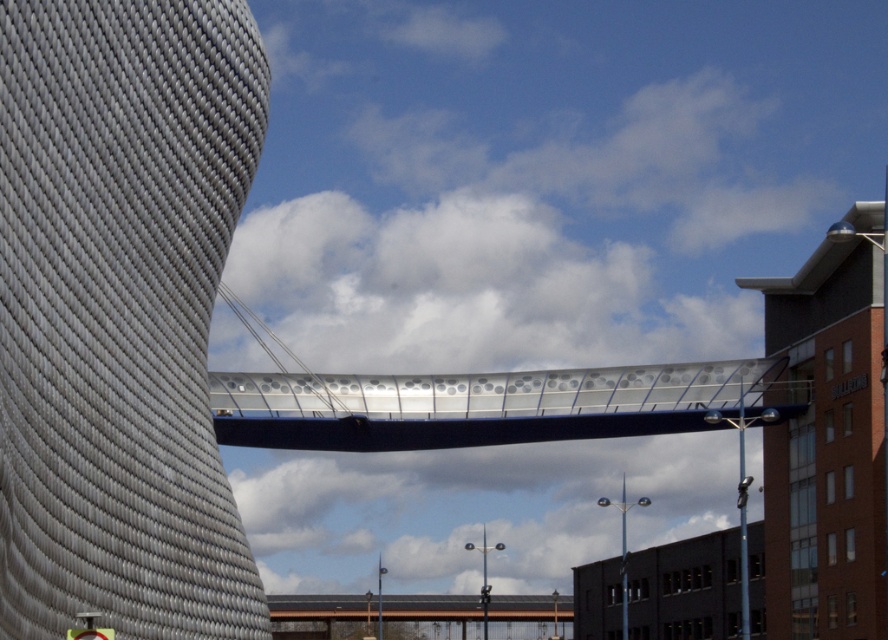
You are an architect evaluating the urban scene. The textured gray tower at center and the metallic gray pedestrian bridge at center are both central to the design. Which structure is taller?

The textured gray tower at center is taller than the metallic gray pedestrian bridge at center.

You are a tourist standing on the metallic silver pedestrian bridge at center and want to take a photo of the brick building at right. Which direction should you face to capture it in your shot?

You should face to the right side of the metallic silver pedestrian bridge at center to capture the brick building at right in your shot, as the brick building at right is located to the right of the metallic silver pedestrian bridge at center.

You are standing at the base of the cylindrical building and looking towards the pedestrian bridge. There are two points marked on the bridge structure. The first point is at coordinates point (799, 541) and the second is at point (640, 426). Which of these two points appears closer to you when viewed from your current position?

Point (640, 426) appears closer to you because it is less further to the camera compared to point (799, 541), which is stated to be further away.